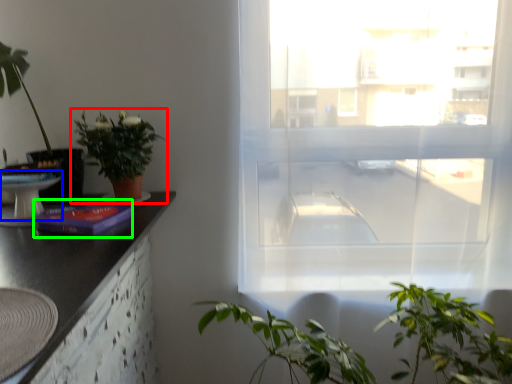
Question: Considering the real-world distances, which object is farthest from houseplant (highlighted by a red box)? round table (highlighted by a blue box) or book (highlighted by a green box)?

Choices:
 (A) round table
 (B) book

Answer: (A)